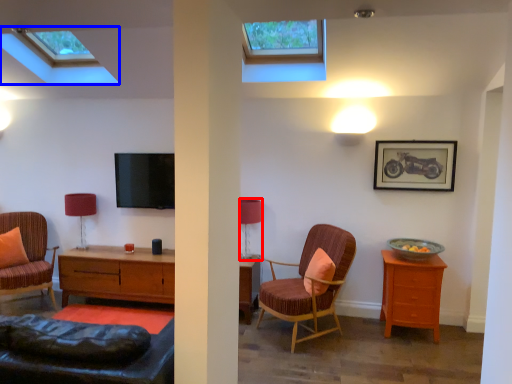
Question: Which point is further to the camera, table lamp (highlighted by a red box) or window (highlighted by a blue box)?

Choices:
 (A) table lamp
 (B) window

Answer: (A)